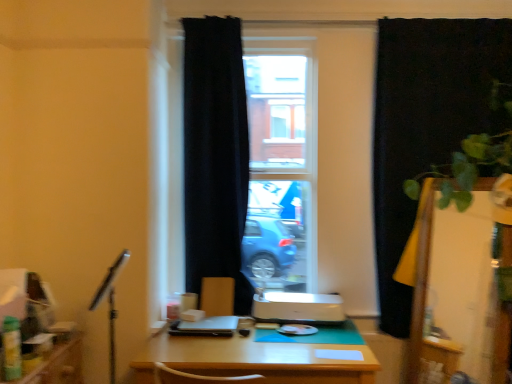
The width and height of the screenshot is (512, 384). Find the location of `vacant area on top of matte brown armchair at center (from a real-world perspective)`. vacant area on top of matte brown armchair at center (from a real-world perspective) is located at coordinates point(216,272).